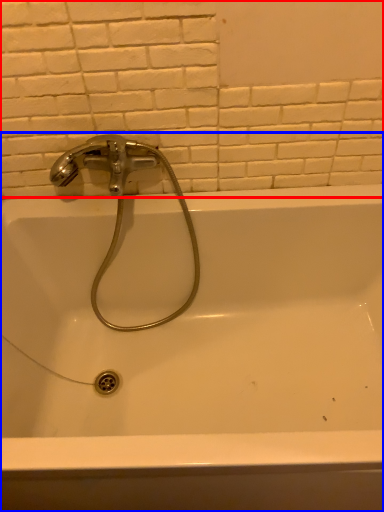
Question: Which object is closer to the camera taking this photo, ceramic tile (highlighted by a red box) or bathtub (highlighted by a blue box)?

Choices:
 (A) ceramic tile
 (B) bathtub

Answer: (B)